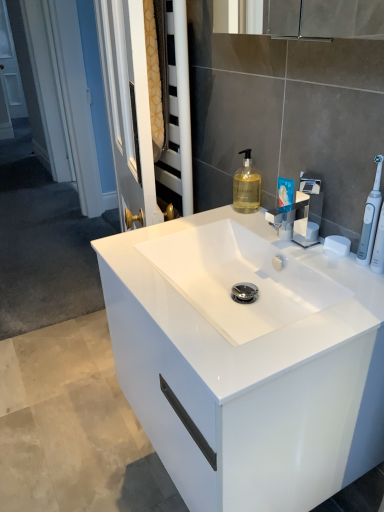
Question: Is white matte soap at upper right at the back of blue glossy toothpaste tube at upper right?

Choices:
 (A) yes
 (B) no

Answer: (B)

Question: Does blue glossy toothpaste tube at upper right appear on the right side of white matte soap at upper right?

Choices:
 (A) no
 (B) yes

Answer: (A)

Question: Is blue glossy toothpaste tube at upper right oriented towards white matte soap at upper right?

Choices:
 (A) no
 (B) yes

Answer: (A)

Question: Is blue glossy toothpaste tube at upper right not inside white matte soap at upper right?

Choices:
 (A) yes
 (B) no

Answer: (A)

Question: Does blue glossy toothpaste tube at upper right have a greater width compared to white matte soap at upper right?

Choices:
 (A) no
 (B) yes

Answer: (A)

Question: Is translucent yellow liquid at center to the left or to the right of white glossy cabinet at center in the image?

Choices:
 (A) left
 (B) right

Answer: (B)

Question: From a real-world perspective, is translucent yellow liquid at center positioned above or below white glossy cabinet at center?

Choices:
 (A) above
 (B) below

Answer: (A)

Question: Considering the positions of translucent yellow liquid at center and white glossy cabinet at center in the image, is translucent yellow liquid at center bigger or smaller than white glossy cabinet at center?

Choices:
 (A) small
 (B) big

Answer: (A)

Question: In terms of width, does translucent yellow liquid at center look wider or thinner when compared to white glossy cabinet at center?

Choices:
 (A) wide
 (B) thin

Answer: (B)

Question: Looking at their shapes, would you say translucent yellow liquid at center is wider or thinner than satin nickel faucet at center?

Choices:
 (A) thin
 (B) wide

Answer: (A)

Question: Is translucent yellow liquid at center spatially inside satin nickel faucet at center, or outside of it?

Choices:
 (A) outside
 (B) inside

Answer: (A)

Question: Would you say translucent yellow liquid at center is to the left or to the right of satin nickel faucet at center in the picture?

Choices:
 (A) left
 (B) right

Answer: (A)

Question: From a real-world perspective, is translucent yellow liquid at center above or below satin nickel faucet at center?

Choices:
 (A) below
 (B) above

Answer: (B)

Question: Choose the correct answer: Is satin nickel faucet at center inside translucent yellow liquid at center or outside it?

Choices:
 (A) outside
 (B) inside

Answer: (A)

Question: Considering the relative positions of satin nickel faucet at center and translucent yellow liquid at center in the image provided, is satin nickel faucet at center to the left or to the right of translucent yellow liquid at center?

Choices:
 (A) right
 (B) left

Answer: (A)